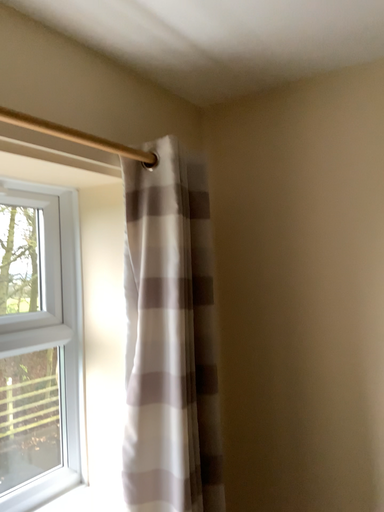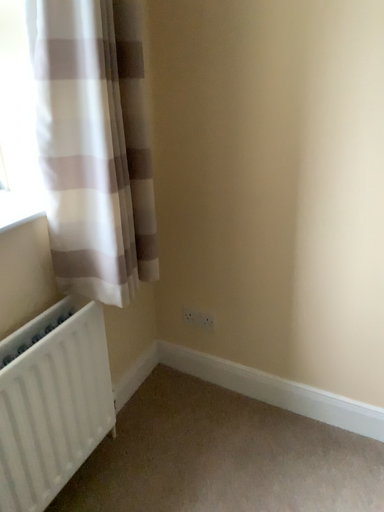
Question: Which way did the camera rotate in the video?

Choices:
 (A) rotated upward
 (B) rotated downward

Answer: (B)